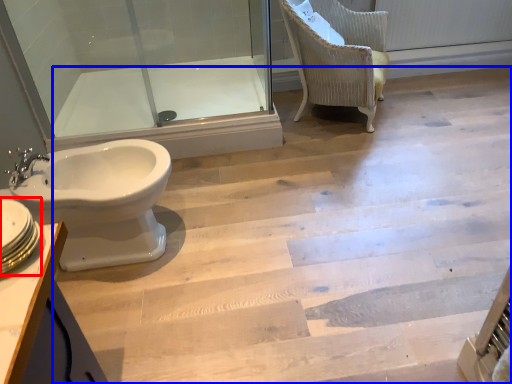
Question: Which point is further to the camera, sink (highlighted by a red box) or stairwell (highlighted by a blue box)?

Choices:
 (A) sink
 (B) stairwell

Answer: (B)